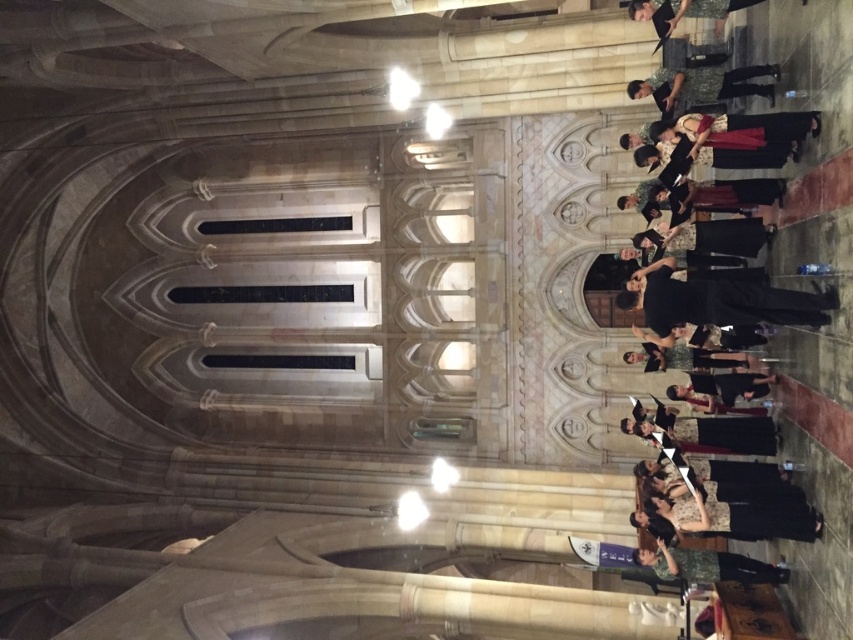
Question: Which object is positioned farthest from the black satin dress at right?

Choices:
 (A) camouflage-patterned shirt at upper center
 (B) camouflage-patterned shirt at lower right

Answer: (B)

Question: Can you confirm if black satin dress at right is thinner than camouflage-patterned shirt at lower right?

Choices:
 (A) yes
 (B) no

Answer: (B)

Question: Which of the following is the closest to the observer?

Choices:
 (A) (674, 84)
 (B) (849, 220)
 (C) (724, 576)

Answer: (B)

Question: Can you confirm if black satin dress at right is wider than camouflage-patterned shirt at upper center?

Choices:
 (A) no
 (B) yes

Answer: (B)

Question: Can you confirm if black satin dress at right is positioned to the right of camouflage-patterned shirt at upper center?

Choices:
 (A) no
 (B) yes

Answer: (B)

Question: Considering the real-world distances, which object is farthest from the black satin dress at right?

Choices:
 (A) camouflage-patterned shirt at upper center
 (B) camouflage-patterned shirt at lower right

Answer: (B)